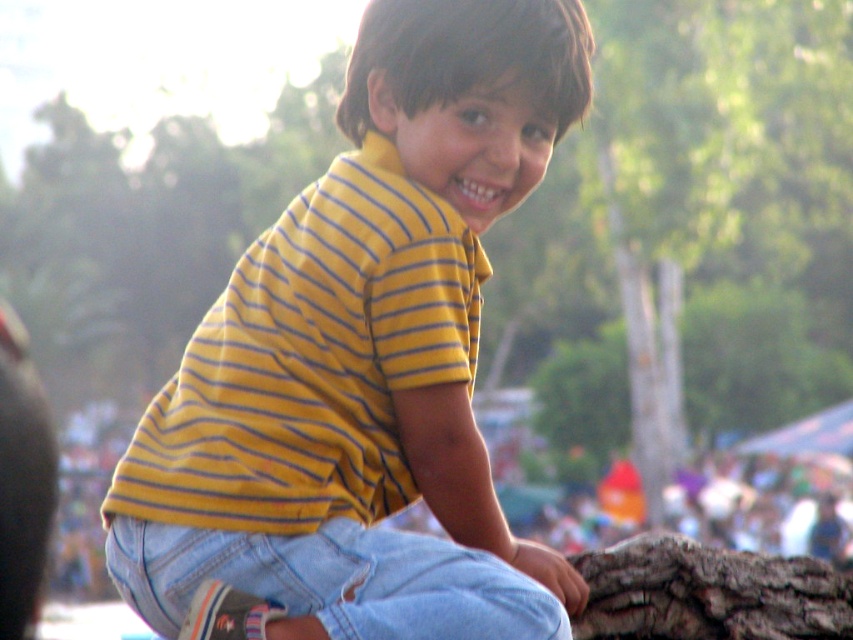
A photographer wants to ensure that both the yellow striped shirt at center and the denim jeans at lower center are clearly visible in the photo. Given that the camera can focus on objects within a 14 inch range, will both items be in focus?

The yellow striped shirt at center and the denim jeans at lower center are 14.18 inches apart from each other. Since the distance between them exceeds the camera focus range of 14 inches, both items may not be in focus simultaneously.

You are a photographer who wants to focus on the yellow striped shirt at center and denim jeans at lower center in the image. Which one will be in sharper focus if you adjust the camera to focus on the boy sitting on the tree stump?

The yellow striped shirt at center will be in sharper focus because it is closer to the camera than the denim jeans at lower center, which are further away.